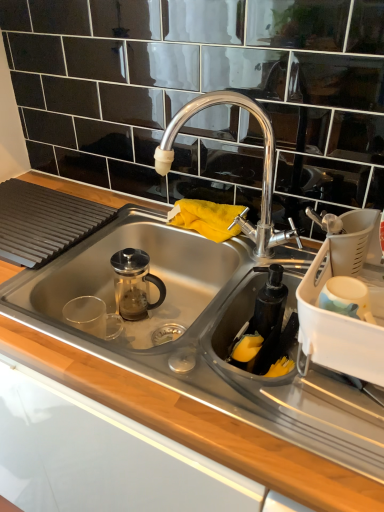
What do you see at coordinates (257, 327) in the screenshot? I see `black matte soap dispenser at lower right, the second appliance positioned from the right` at bounding box center [257, 327].

What is the approximate width of stainless steel sink at center?

stainless steel sink at center is 20.07 inches in width.

Where is `black matte soap dispenser at lower right, the second appliance positioned from the right`? This screenshot has width=384, height=512. black matte soap dispenser at lower right, the second appliance positioned from the right is located at coordinates (257, 327).

Is point (181, 121) positioned in front of point (206, 336)?

That is True.

From a real-world perspective, is polished chrome faucet at center above or below black matte soap dispenser at lower right, the 1th appliance viewed from the left?

polished chrome faucet at center is above black matte soap dispenser at lower right, the 1th appliance viewed from the left.

Can you confirm if polished chrome faucet at center is positioned to the right of black matte soap dispenser at lower right, the second appliance positioned from the right?

In fact, polished chrome faucet at center is to the left of black matte soap dispenser at lower right, the second appliance positioned from the right.

Is polished chrome faucet at center shorter than black matte soap dispenser at lower right, the second appliance positioned from the right?

In fact, polished chrome faucet at center may be taller than black matte soap dispenser at lower right, the second appliance positioned from the right.

Between polished chrome faucet at center and white plastic dish rack at right, which is the first appliance in right-to-left order, which one appears on the right side from the viewer's perspective?

Positioned to the right is white plastic dish rack at right, which is the first appliance in right-to-left order.

From a real-world perspective, which is physically above, polished chrome faucet at center or white plastic dish rack at right, which is the first appliance in right-to-left order?

polished chrome faucet at center.

Which is behind, point (269, 145) or point (349, 331)?

The point (269, 145) is farther.

Based on the photo, how distant is polished chrome faucet at center from white plastic dish rack at right, the second appliance from the left?

polished chrome faucet at center is 11.29 inches away from white plastic dish rack at right, the second appliance from the left.

Would you say white plastic dish rack at right, the second appliance from the left, is a long distance from black matte soap dispenser at lower right, the second appliance positioned from the right?

No, white plastic dish rack at right, the second appliance from the left, is not far from black matte soap dispenser at lower right, the second appliance positioned from the right.

Looking at this image, does white plastic dish rack at right, the second appliance from the left, appear on the left side of black matte soap dispenser at lower right, the 1th appliance viewed from the left?

No.

Is white plastic dish rack at right, the second appliance from the left, bigger or smaller than black matte soap dispenser at lower right, the second appliance positioned from the right?

white plastic dish rack at right, the second appliance from the left, is bigger than black matte soap dispenser at lower right, the second appliance positioned from the right.

Between white plastic dish rack at right, which is the first appliance in right-to-left order, and black matte soap dispenser at lower right, the 1th appliance viewed from the left, which one has more height?

white plastic dish rack at right, which is the first appliance in right-to-left order, is taller.

Is point (206, 393) less distant than point (380, 344)?

No, it is not.

Does stainless steel sink at center come behind white plastic dish rack at right, the second appliance from the left?

Yes, stainless steel sink at center is behind white plastic dish rack at right, the second appliance from the left.

Considering the sizes of objects stainless steel sink at center and white plastic dish rack at right, which is the first appliance in right-to-left order, in the image provided, who is taller, stainless steel sink at center or white plastic dish rack at right, which is the first appliance in right-to-left order,?

With more height is stainless steel sink at center.

Considering the sizes of objects stainless steel sink at center and white plastic dish rack at right, the second appliance from the left, in the image provided, who is smaller, stainless steel sink at center or white plastic dish rack at right, the second appliance from the left,?

white plastic dish rack at right, the second appliance from the left, is smaller.

Between stainless steel sink at center and black matte soap dispenser at lower right, the second appliance positioned from the right, which one appears on the right side from the viewer's perspective?

Positioned to the right is black matte soap dispenser at lower right, the second appliance positioned from the right.

Is stainless steel sink at center bigger or smaller than black matte soap dispenser at lower right, the second appliance positioned from the right?

Considering their sizes, stainless steel sink at center takes up more space than black matte soap dispenser at lower right, the second appliance positioned from the right.

The height and width of the screenshot is (512, 384). In the image, there is a stainless steel sink at center. Identify the location of appliance below it (from the image's perspective). (257, 327).

From the image's perspective, is stainless steel sink at center on top of black matte soap dispenser at lower right, the 1th appliance viewed from the left?

Correct, stainless steel sink at center appears higher than black matte soap dispenser at lower right, the 1th appliance viewed from the left, in the image.

From the picture: Considering the relative sizes of black matte soap dispenser at lower right, the second appliance positioned from the right, and polished chrome faucet at center in the image provided, is black matte soap dispenser at lower right, the second appliance positioned from the right, wider than polished chrome faucet at center?

No, black matte soap dispenser at lower right, the second appliance positioned from the right, is not wider than polished chrome faucet at center.

Could you tell me if black matte soap dispenser at lower right, the 1th appliance viewed from the left, is facing polished chrome faucet at center?

No, black matte soap dispenser at lower right, the 1th appliance viewed from the left, is not turned towards polished chrome faucet at center.

Does black matte soap dispenser at lower right, the 1th appliance viewed from the left, appear on the right side of polished chrome faucet at center?

Correct, you'll find black matte soap dispenser at lower right, the 1th appliance viewed from the left, to the right of polished chrome faucet at center.

Consider the image. Is black matte soap dispenser at lower right, the 1th appliance viewed from the left, with polished chrome faucet at center?

They are not placed beside each other.

Is white plastic dish rack at right, which is the first appliance in right-to-left order, taller than polished chrome faucet at center?

Incorrect, the height of white plastic dish rack at right, which is the first appliance in right-to-left order, is not larger of that of polished chrome faucet at center.

Which of these two, white plastic dish rack at right, the second appliance from the left, or polished chrome faucet at center, is smaller?

Smaller between the two is white plastic dish rack at right, the second appliance from the left.

Is white plastic dish rack at right, which is the first appliance in right-to-left order, in contact with polished chrome faucet at center?

No, white plastic dish rack at right, which is the first appliance in right-to-left order, is not in contact with polished chrome faucet at center.

How distant is white plastic dish rack at right, which is the first appliance in right-to-left order, from polished chrome faucet at center?

white plastic dish rack at right, which is the first appliance in right-to-left order, and polished chrome faucet at center are 11.29 inches apart.

At what (x,y) coordinates should I click in order to perform the action: click on the 2nd appliance below the polished chrome faucet at center (from the image's perspective). Please return your answer as a coordinate pair (x, y). This screenshot has width=384, height=512. Looking at the image, I should click on (257, 327).

Where is `tap lying above the white plastic dish rack at right, the second appliance from the left (from the image's perspective)`? The image size is (384, 512). tap lying above the white plastic dish rack at right, the second appliance from the left (from the image's perspective) is located at coordinates (263, 164).

Considering their positions, is black matte soap dispenser at lower right, the second appliance positioned from the right, positioned closer to polished chrome faucet at center than white plastic dish rack at right, the second appliance from the left?

black matte soap dispenser at lower right, the second appliance positioned from the right, lies closer to polished chrome faucet at center than the other object.

Considering their positions, is white plastic dish rack at right, the second appliance from the left, positioned further to stainless steel sink at center than black matte soap dispenser at lower right, the second appliance positioned from the right?

white plastic dish rack at right, the second appliance from the left.

Looking at the image, which one is located further to stainless steel sink at center, black matte soap dispenser at lower right, the second appliance positioned from the right, or white plastic dish rack at right, which is the first appliance in right-to-left order?

white plastic dish rack at right, which is the first appliance in right-to-left order, is positioned further to the anchor stainless steel sink at center.

Which object lies further to the anchor point white plastic dish rack at right, the second appliance from the left, polished chrome faucet at center or black matte soap dispenser at lower right, the second appliance positioned from the right?

The object further to white plastic dish rack at right, the second appliance from the left, is polished chrome faucet at center.

Estimate the real-world distances between objects in this image. Which object is further from black matte soap dispenser at lower right, the 1th appliance viewed from the left, white plastic dish rack at right, the second appliance from the left, or stainless steel sink at center?

stainless steel sink at center.

When comparing their distances from black matte soap dispenser at lower right, the second appliance positioned from the right, does stainless steel sink at center or white plastic dish rack at right, the second appliance from the left, seem closer?

white plastic dish rack at right, the second appliance from the left, is closer to black matte soap dispenser at lower right, the second appliance positioned from the right.

Estimate the real-world distances between objects in this image. Which object is closer to stainless steel sink at center, white plastic dish rack at right, which is the first appliance in right-to-left order, or polished chrome faucet at center?

polished chrome faucet at center is closer to stainless steel sink at center.

When comparing their distances from black matte soap dispenser at lower right, the second appliance positioned from the right, does white plastic dish rack at right, which is the first appliance in right-to-left order, or polished chrome faucet at center seem closer?

The object closer to black matte soap dispenser at lower right, the second appliance positioned from the right, is white plastic dish rack at right, which is the first appliance in right-to-left order.

Where is `appliance between stainless steel sink at center and white plastic dish rack at right, the second appliance from the left, in the horizontal direction`? The height and width of the screenshot is (512, 384). appliance between stainless steel sink at center and white plastic dish rack at right, the second appliance from the left, in the horizontal direction is located at coordinates (257, 327).

You are a GUI agent. You are given a task and a screenshot of the screen. Output one action in this format:
    pyautogui.click(x=<x>, y=<y>)
    Task: Click on the appliance between polished chrome faucet at center and black matte soap dispenser at lower right, the second appliance positioned from the right, in the vertical direction
    Image resolution: width=384 pixels, height=512 pixels.
    Given the screenshot: What is the action you would take?
    pyautogui.click(x=342, y=315)

What are the coordinates of `tap between stainless steel sink at center and white plastic dish rack at right, which is the first appliance in right-to-left order, from left to right` in the screenshot? It's located at (263, 164).

Identify the location of sink between polished chrome faucet at center and black matte soap dispenser at lower right, the 1th appliance viewed from the left, vertically. (160, 305).